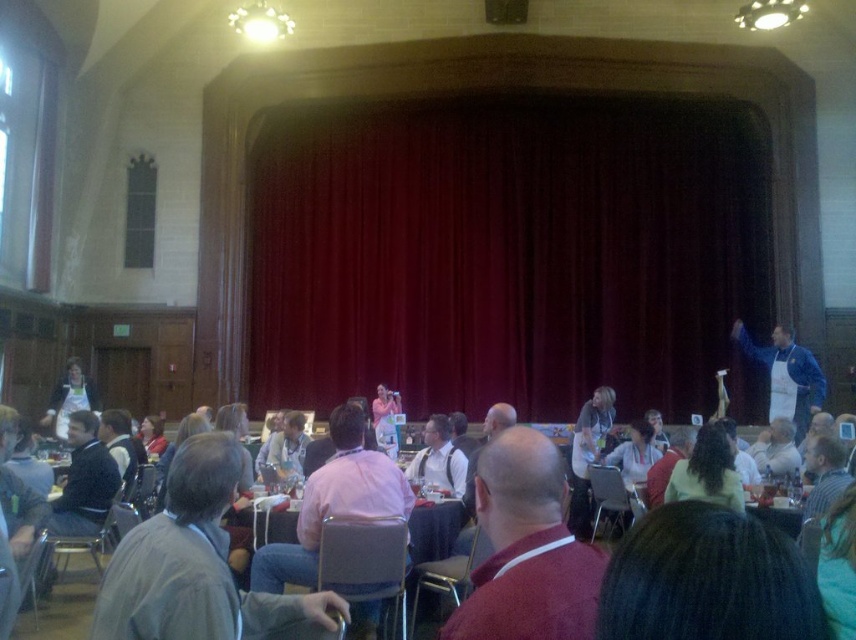
Question: Where is red velvet curtain at center located in relation to matte white shirt at center in the image?

Choices:
 (A) right
 (B) left

Answer: (A)

Question: Where is red velvet curtain at center located in relation to matte pink shirt at center in the image?

Choices:
 (A) below
 (B) above

Answer: (B)

Question: Is curly hair at center to the right of matte pink shirt at center from the viewer's perspective?

Choices:
 (A) no
 (B) yes

Answer: (B)

Question: Which point is farther from the camera taking this photo?

Choices:
 (A) (272, 460)
 (B) (589, 573)
 (C) (599, 113)

Answer: (C)

Question: Which point appears farthest from the camera in this image?

Choices:
 (A) (698, 481)
 (B) (209, 468)
 (C) (444, 488)

Answer: (C)

Question: Estimate the real-world distances between objects in this image. Which object is closer to the gray fabric jacket at lower left?

Choices:
 (A) curly hair at center
 (B) matte pink shirt at center
 (C) matte white shirt at center
 (D) maroon fabric shirt at center

Answer: (D)